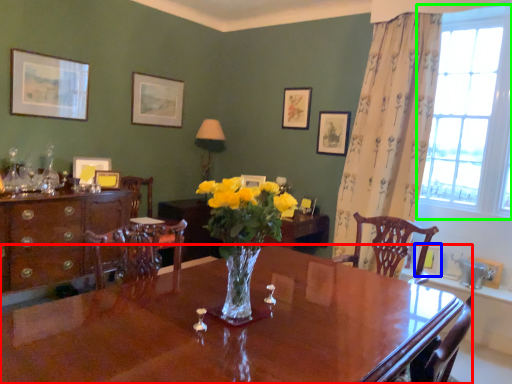
Question: Which object is the closest to the desk (highlighted by a red box)? Choose among these: picture frame (highlighted by a blue box) or window (highlighted by a green box).

Choices:
 (A) picture frame
 (B) window

Answer: (A)